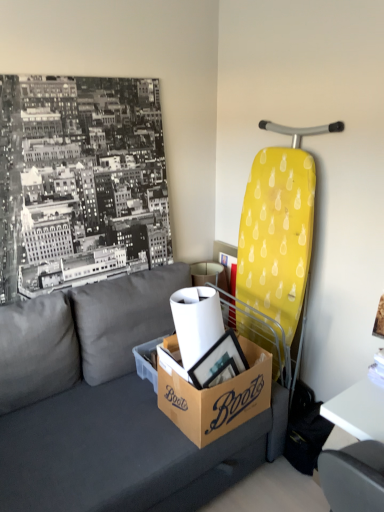
Question: Is dark gray fabric couch at center taller or shorter than brown cardboard box at lower center?

Choices:
 (A) short
 (B) tall

Answer: (B)

Question: Relative to brown cardboard box at lower center, is dark gray fabric couch at center in front or behind?

Choices:
 (A) front
 (B) behind

Answer: (A)

Question: Estimate the real-world distances between objects in this image. Which object is closer to the brown cardboard box at lower center?

Choices:
 (A) brown cardboard box at center
 (B) dark gray fabric couch at center
 (C) white glossy table at lower right

Answer: (A)

Question: Based on their relative distances, which object is nearer to the dark gray fabric couch at center?

Choices:
 (A) brown cardboard box at lower center
 (B) brown cardboard box at center
 (C) white glossy table at lower right

Answer: (B)